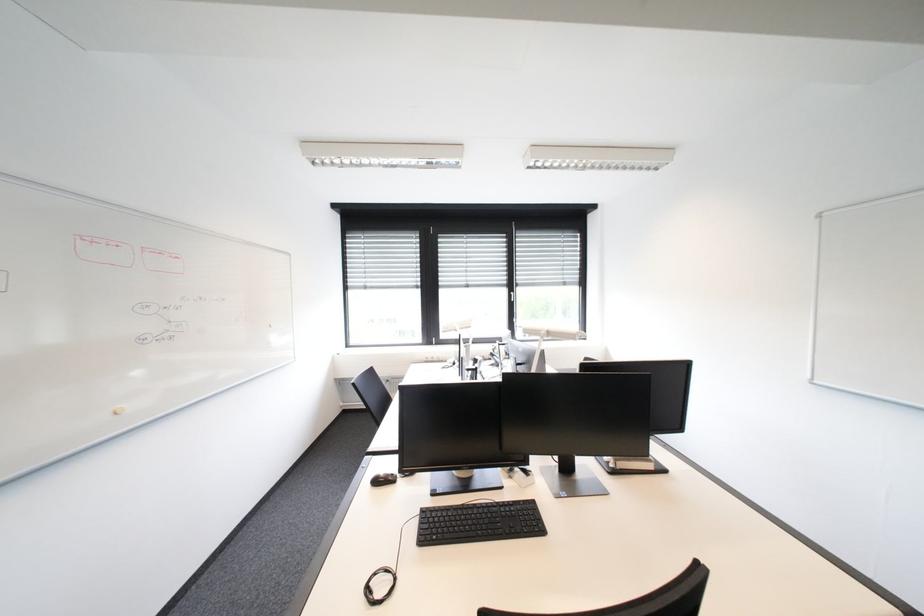
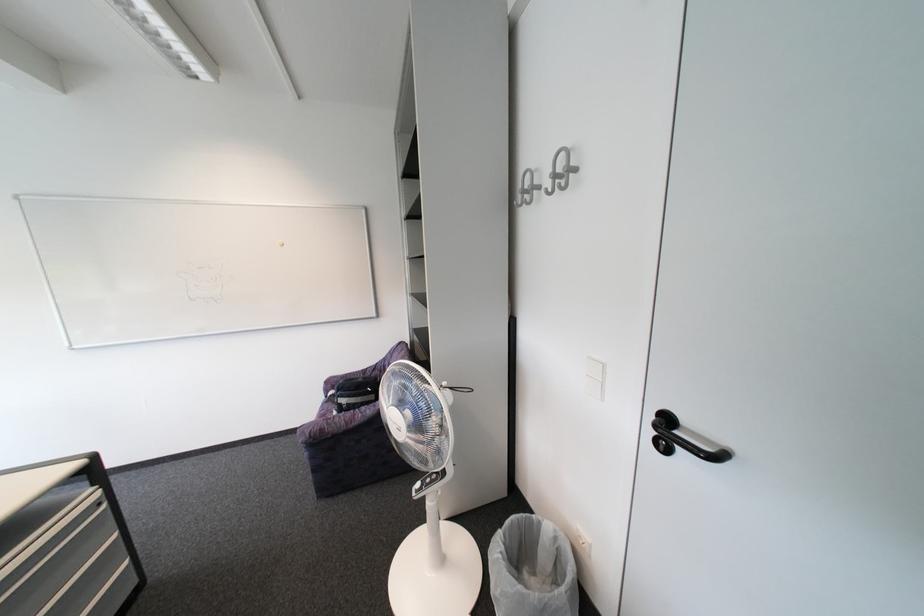
Question: How did the camera likely rotate?

Choices:
 (A) Left
 (B) Right
 (C) Up
 (D) Down

Answer: (B)